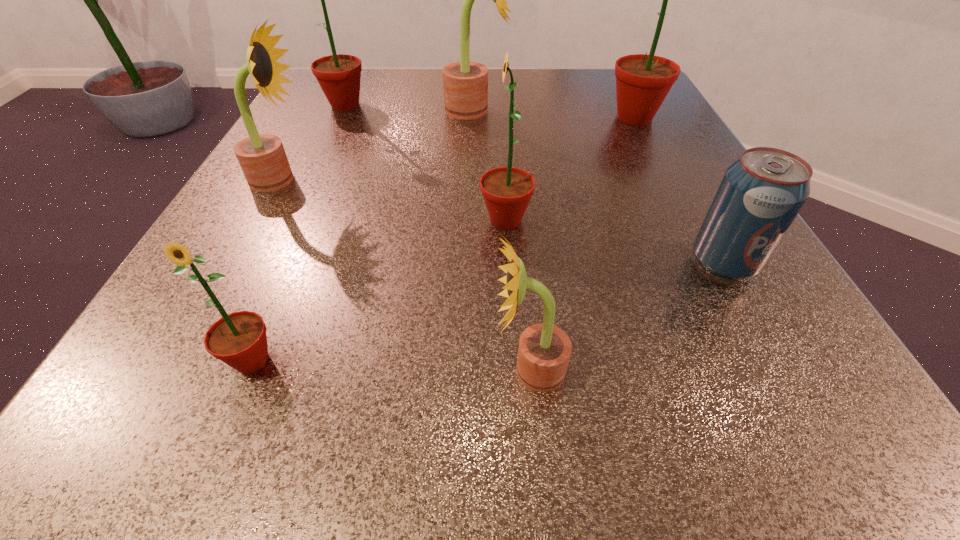
I want to click on free point between the biggest green sunflower and the smallest yellow sunflower, so click(x=582, y=244).

Where is `blank region between the farthest yellow sunflower and the tallest sunflower`? blank region between the farthest yellow sunflower and the tallest sunflower is located at coordinates (555, 113).

Identify the location of blank region between the fourth nearest sunflower and the smallest yellow sunflower. (405, 275).

This screenshot has width=960, height=540. Identify the location of free spot between the smallest green sunflower and the biggest green sunflower. (444, 239).

Where is `free point between the smallest green sunflower and the fifth farthest sunflower`? The height and width of the screenshot is (540, 960). free point between the smallest green sunflower and the fifth farthest sunflower is located at coordinates (379, 290).

The height and width of the screenshot is (540, 960). I want to click on object identified as the second closest to the smallest yellow sunflower, so click(761, 193).

Locate an element on the screen. object that is the third closest to the fourth nearest object is located at coordinates (465, 84).

Select which sunflower appears as the fifth closest to the tallest object. Please provide its 2D coordinates. Your answer should be formatted as a tuple, i.e. [(x, y)], where the tuple contains the x and y coordinates of a point satisfying the conditions above.

[(262, 158)]

Point out which sunflower is positioned as the nearest to the pop soda. Please provide its 2D coordinates. Your answer should be formatted as a tuple, i.e. [(x, y)], where the tuple contains the x and y coordinates of a point satisfying the conditions above.

[(507, 191)]

Locate which green sunflower is the third closest to the farthest yellow sunflower. Please provide its 2D coordinates. Your answer should be formatted as a tuple, i.e. [(x, y)], where the tuple contains the x and y coordinates of a point satisfying the conditions above.

[(507, 191)]